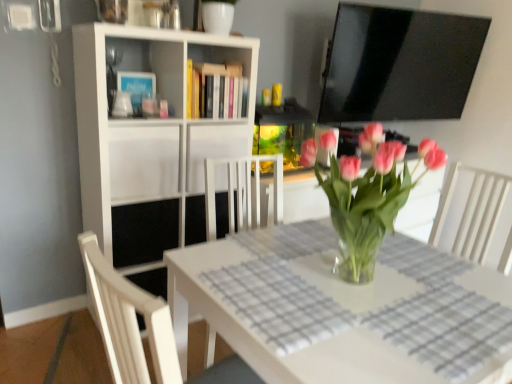
The width and height of the screenshot is (512, 384). What do you see at coordinates (213, 149) in the screenshot?
I see `white matte cabinet at center, which ranks as the 1th cabinet in right-to-left order` at bounding box center [213, 149].

In order to click on pink glass vase at center in this screenshot , I will do `click(368, 196)`.

Find the location of a particular element. hardcover books at upper center is located at coordinates (216, 91).

Locate an element on the screen. Image resolution: width=512 pixels, height=384 pixels. white matte cabinet at center, marked as the second cabinet in a left-to-right arrangement is located at coordinates (213, 149).

From the image's perspective, between white matte bookshelf at upper left, which appears as the second shelf when ordered from the bottom, and pink glass vase at center, who is located below?

pink glass vase at center.

Is white matte bookshelf at upper left, the first shelf in the top-to-bottom sequence, taller or shorter than pink glass vase at center?

white matte bookshelf at upper left, the first shelf in the top-to-bottom sequence, is taller than pink glass vase at center.

Is white matte bookshelf at upper left, the first shelf in the top-to-bottom sequence, looking in the opposite direction of pink glass vase at center?

No, white matte bookshelf at upper left, the first shelf in the top-to-bottom sequence,'s orientation is not away from pink glass vase at center.

Who is bigger, white matte bookshelf at upper left, which appears as the second shelf when ordered from the bottom, or pink glass vase at center?

Bigger between the two is white matte bookshelf at upper left, which appears as the second shelf when ordered from the bottom.

Which object is further away from the camera taking this photo, white matte cabinet at center, the 1th cabinet when ordered from left to right, or pink glass vase at center?

white matte cabinet at center, the 1th cabinet when ordered from left to right, is behind.

Considering the sizes of objects white matte cabinet at center, the second cabinet positioned from the right, and pink glass vase at center in the image provided, who is bigger, white matte cabinet at center, the second cabinet positioned from the right, or pink glass vase at center?

pink glass vase at center.

Considering the relative sizes of white matte cabinet at center, the 1th cabinet when ordered from left to right, and pink glass vase at center in the image provided, is white matte cabinet at center, the 1th cabinet when ordered from left to right, thinner than pink glass vase at center?

Incorrect, the width of white matte cabinet at center, the 1th cabinet when ordered from left to right, is not less than that of pink glass vase at center.

Based on the photo, can pink glass vase at center be found inside white matte cabinet at center, the 1th cabinet when ordered from left to right?

No, pink glass vase at center is not a part of white matte cabinet at center, the 1th cabinet when ordered from left to right.

How many degrees apart are the facing directions of hardcover books at upper center and pink glass vase at center?

The angle between the facing direction of hardcover books at upper center and the facing direction of pink glass vase at center is 1.25 degrees.

From the image's perspective, relative to pink glass vase at center, is hardcover books at upper center above or below?

From the image's perspective, hardcover books at upper center appears above pink glass vase at center.

You are a GUI agent. You are given a task and a screenshot of the screen. Output one action in this format:
    pyautogui.click(x=<x>, y=<y>)
    Task: Click on the book that appears above the pink glass vase at center (from the image's perspective)
    This screenshot has height=384, width=512.
    Given the screenshot: What is the action you would take?
    pyautogui.click(x=216, y=91)

From the image's perspective, is white matte cabinet at center, marked as the second cabinet in a left-to-right arrangement, located beneath white matte cabinet at center, the second cabinet positioned from the right?

No, from the image's perspective, white matte cabinet at center, marked as the second cabinet in a left-to-right arrangement, is not below white matte cabinet at center, the second cabinet positioned from the right.

Locate an element on the screen. The height and width of the screenshot is (384, 512). cabinet above the white matte cabinet at center, marked as the second cabinet in a left-to-right arrangement (from a real-world perspective) is located at coordinates click(144, 163).

Does white matte cabinet at center, which ranks as the 1th cabinet in right-to-left order, turn towards white matte cabinet at center, the 1th cabinet when ordered from left to right?

No, white matte cabinet at center, which ranks as the 1th cabinet in right-to-left order, is not aimed at white matte cabinet at center, the 1th cabinet when ordered from left to right.

Considering the sizes of white matte cabinet at center, which ranks as the 1th cabinet in right-to-left order, and white matte cabinet at center, the second cabinet positioned from the right, in the image, is white matte cabinet at center, which ranks as the 1th cabinet in right-to-left order, wider or thinner than white matte cabinet at center, the second cabinet positioned from the right,?

Considering their sizes, white matte cabinet at center, which ranks as the 1th cabinet in right-to-left order, looks slimmer than white matte cabinet at center, the second cabinet positioned from the right.

Consider the image. From the image's perspective, does white matte bookshelf at upper left, the first shelf in the top-to-bottom sequence, appear lower than white matte cabinet at center, the second cabinet positioned from the right?

Yes, from the image's perspective, white matte bookshelf at upper left, the first shelf in the top-to-bottom sequence, is below white matte cabinet at center, the second cabinet positioned from the right.

Is white matte bookshelf at upper left, which appears as the second shelf when ordered from the bottom, positioned before white matte cabinet at center, the 1th cabinet when ordered from left to right?

Yes, the depth of white matte bookshelf at upper left, which appears as the second shelf when ordered from the bottom, is less than that of white matte cabinet at center, the 1th cabinet when ordered from left to right.

Considering the sizes of objects white matte bookshelf at upper left, the first shelf in the top-to-bottom sequence, and white matte cabinet at center, the second cabinet positioned from the right, in the image provided, who is taller, white matte bookshelf at upper left, the first shelf in the top-to-bottom sequence, or white matte cabinet at center, the second cabinet positioned from the right,?

white matte bookshelf at upper left, the first shelf in the top-to-bottom sequence.

How much distance is there between white matte bookshelf at upper left, which appears as the second shelf when ordered from the bottom, and white matte cabinet at center, the 1th cabinet when ordered from left to right?

They are 5.31 inches apart.

Is white matte cabinet at center, marked as the second cabinet in a left-to-right arrangement, a part of white matte bookshelf at upper left, which appears as the second shelf when ordered from the bottom?

Yes, white matte cabinet at center, marked as the second cabinet in a left-to-right arrangement, is a part of white matte bookshelf at upper left, which appears as the second shelf when ordered from the bottom.

From a real-world perspective, relative to white matte cabinet at center, which ranks as the 1th cabinet in right-to-left order, is white matte bookshelf at upper left, which appears as the second shelf when ordered from the bottom, vertically above or below?

white matte bookshelf at upper left, which appears as the second shelf when ordered from the bottom, is situated lower than white matte cabinet at center, which ranks as the 1th cabinet in right-to-left order, in the real world.

In the scene shown: Does white matte bookshelf at upper left, which appears as the second shelf when ordered from the bottom, have a lesser height compared to white matte cabinet at center, marked as the second cabinet in a left-to-right arrangement?

Incorrect, the height of white matte bookshelf at upper left, which appears as the second shelf when ordered from the bottom, does not fall short of that of white matte cabinet at center, marked as the second cabinet in a left-to-right arrangement.

Which object is thinner, hardcover books at upper center or white matte bookshelf at upper left, which appears as the second shelf when ordered from the bottom?

hardcover books at upper center.

Is hardcover books at upper center shorter than white matte bookshelf at upper left, the first shelf in the top-to-bottom sequence?

Indeed, hardcover books at upper center has a lesser height compared to white matte bookshelf at upper left, the first shelf in the top-to-bottom sequence.

Between point (243, 93) and point (76, 69), which one is positioned in front?

The point (76, 69) is closer.

I want to click on houseplant in front of the white matte bookshelf at upper left, the first shelf in the top-to-bottom sequence, so click(368, 196).

Find the location of a particular element. The image size is (512, 384). the 1st cabinet above the pink glass vase at center (from the image's perspective) is located at coordinates (144, 163).

Estimate the real-world distances between objects in this image. Which object is further from black matte shelf at center, which is the 1th shelf in bottom-to-top order, hardcover books at upper center or clear glass table at center?

clear glass table at center lies further to black matte shelf at center, which is the 1th shelf in bottom-to-top order, than the other object.

From the image, which object appears to be farther from hardcover books at upper center, pink glass vase at center or black matte shelf at center, placed as the second shelf when sorted from top to bottom?

Based on the image, pink glass vase at center appears to be further to hardcover books at upper center.

When comparing their distances from white matte bookshelf at upper left, the first shelf in the top-to-bottom sequence, does white matte cabinet at center, which ranks as the 1th cabinet in right-to-left order, or white matte cabinet at center, the 1th cabinet when ordered from left to right, seem further?

white matte cabinet at center, which ranks as the 1th cabinet in right-to-left order, is positioned further to the anchor white matte bookshelf at upper left, the first shelf in the top-to-bottom sequence.

Looking at the image, which one is located closer to pink glass vase at center, clear glass table at center or black matte shelf at center, which is the 1th shelf in bottom-to-top order?

Among the two, clear glass table at center is located nearer to pink glass vase at center.

Which object lies nearer to the anchor point pink glass vase at center, black matte shelf at center, placed as the second shelf when sorted from top to bottom, or clear glass table at center?

clear glass table at center lies closer to pink glass vase at center than the other object.

From the image, which object appears to be farther from clear glass table at center, pink glass vase at center or white matte cabinet at center, the 1th cabinet when ordered from left to right?

white matte cabinet at center, the 1th cabinet when ordered from left to right, is positioned further to the anchor clear glass table at center.

From the image, which object appears to be nearer to pink glass vase at center, white matte bookshelf at upper left, the first shelf in the top-to-bottom sequence, or clear glass table at center?

clear glass table at center is closer to pink glass vase at center.

Consider the image. Based on their spatial positions, is white matte bookshelf at upper left, the first shelf in the top-to-bottom sequence, or pink glass vase at center closer to black matte shelf at center, which is the 1th shelf in bottom-to-top order?

white matte bookshelf at upper left, the first shelf in the top-to-bottom sequence, lies closer to black matte shelf at center, which is the 1th shelf in bottom-to-top order, than the other object.

Where is `houseplant positioned between clear glass table at center and white matte bookshelf at upper left, which appears as the second shelf when ordered from the bottom, from near to far`? houseplant positioned between clear glass table at center and white matte bookshelf at upper left, which appears as the second shelf when ordered from the bottom, from near to far is located at coordinates (368, 196).

Find the location of a particular element. shelf located between white matte cabinet at center, the second cabinet positioned from the right, and white matte cabinet at center, which ranks as the 1th cabinet in right-to-left order, in the left-right direction is located at coordinates (151, 140).

The height and width of the screenshot is (384, 512). In order to click on cabinet between white matte cabinet at center, the second cabinet positioned from the right, and hardcover books at upper center, in the horizontal direction in this screenshot , I will do `click(213, 149)`.

Find the location of a particular element. The width and height of the screenshot is (512, 384). shelf between pink glass vase at center and black matte shelf at center, placed as the second shelf when sorted from top to bottom, from front to back is located at coordinates (151, 140).